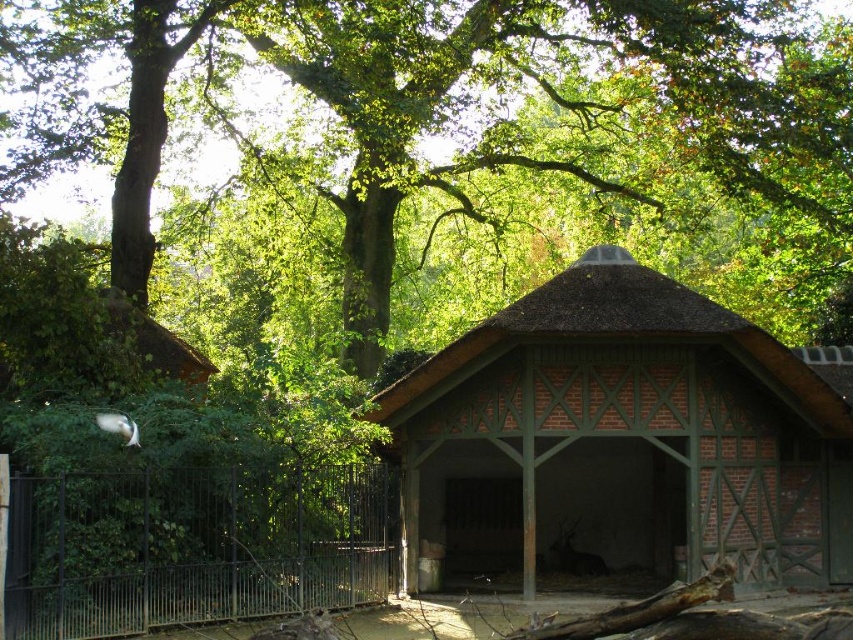
Who is more forward, (282, 180) or (636, 467)?

Positioned in front is point (636, 467).

Is green leafy tree at upper center thinner than brown brick hut at center?

No.

This screenshot has height=640, width=853. In order to click on green leafy tree at upper center in this screenshot , I will do `click(450, 147)`.

Locate an element on the screen. green leafy tree at upper center is located at coordinates (450, 147).

Which is more to the left, green leafy tree at upper center or black metal fence at lower left?

black metal fence at lower left

Where is `green leafy tree at upper center`? Image resolution: width=853 pixels, height=640 pixels. green leafy tree at upper center is located at coordinates (450, 147).

The height and width of the screenshot is (640, 853). What do you see at coordinates (450, 147) in the screenshot? I see `green leafy tree at upper center` at bounding box center [450, 147].

Identify the location of green leafy tree at upper center. This screenshot has height=640, width=853. (450, 147).

In the scene shown: Between brown brick hut at center and black metal fence at lower left, which one has more height?

brown brick hut at center

Is brown brick hut at center smaller than black metal fence at lower left?

Actually, brown brick hut at center might be larger than black metal fence at lower left.

Which is behind, point (846, 504) or point (26, 556)?

The point (846, 504) is behind.

The height and width of the screenshot is (640, 853). Identify the location of brown brick hut at center. (624, 440).